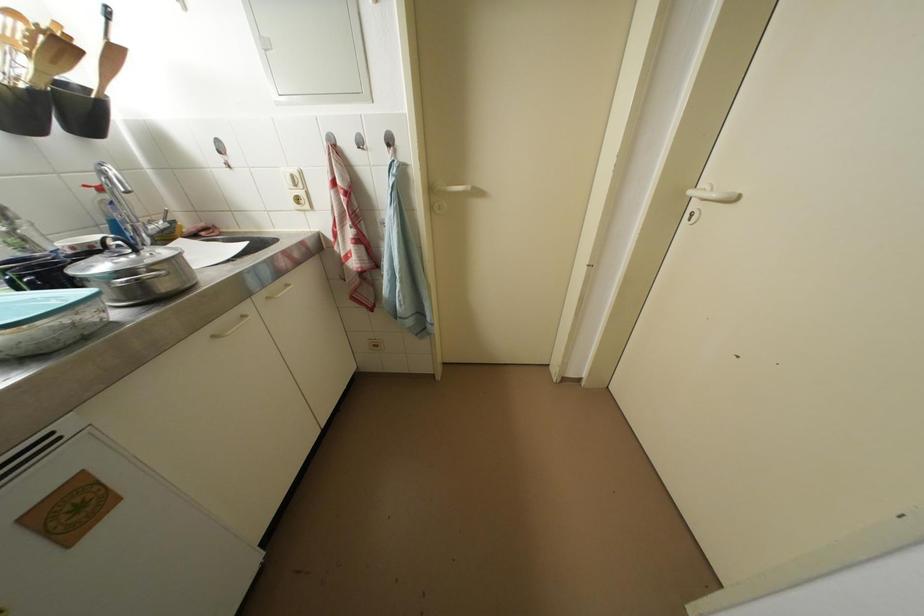
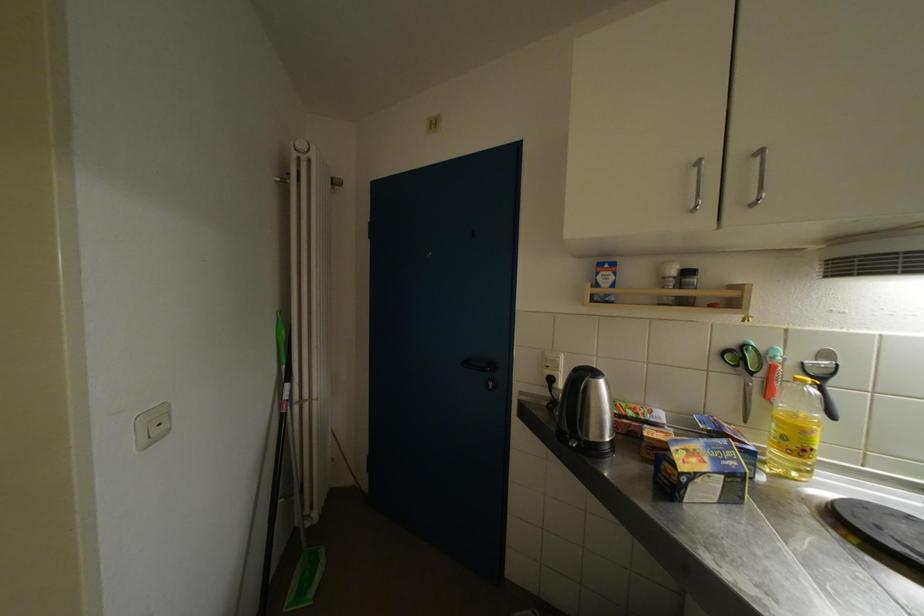
The images are taken continuously from a first-person perspective. In which direction is your viewpoint rotating?

The rotation direction of the camera is left-down.